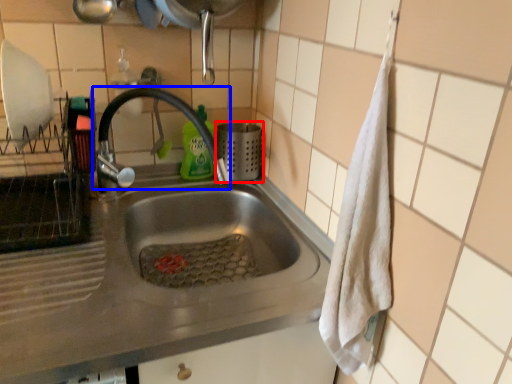
Question: Which point is further to the camera, appliance (highlighted by a red box) or tap (highlighted by a blue box)?

Choices:
 (A) appliance
 (B) tap

Answer: (A)